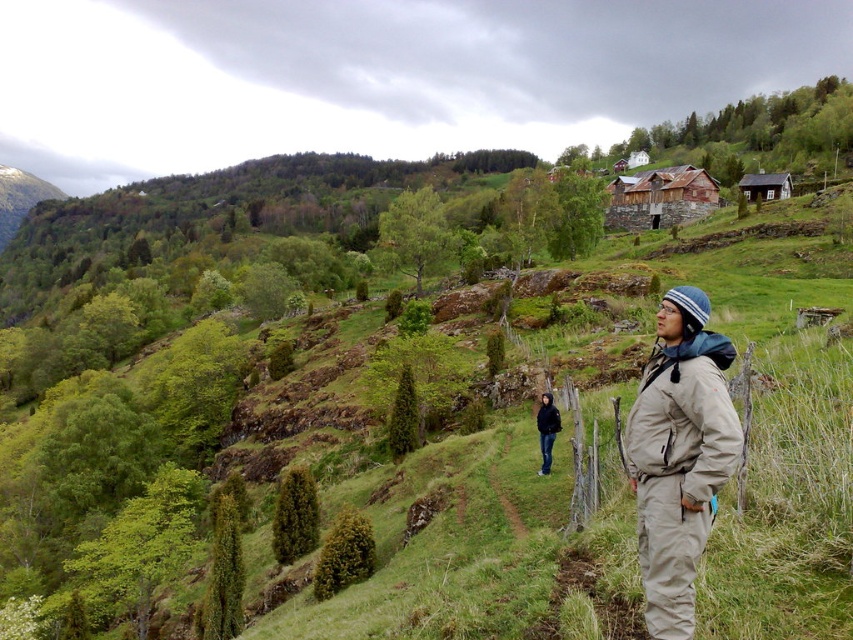
Describe the element at coordinates (172, 449) in the screenshot. I see `green grassy hillside at center` at that location.

Between green grassy hillside at center and dark blue jacket at center, which one is positioned higher?

dark blue jacket at center is higher up.

Between point (831, 445) and point (537, 428), which one is positioned in front?

Point (831, 445) is in front.

This screenshot has width=853, height=640. In order to click on green grassy hillside at center in this screenshot , I will do 172,449.

Does khaki fleece jacket at center have a greater height compared to dark blue jacket at center?

No, khaki fleece jacket at center is not taller than dark blue jacket at center.

The width and height of the screenshot is (853, 640). Find the location of `khaki fleece jacket at center`. khaki fleece jacket at center is located at coordinates (685, 417).

Measure the distance between green grassy hillside at center and khaki fleece jacket at center.

green grassy hillside at center is 155.07 feet away from khaki fleece jacket at center.

The width and height of the screenshot is (853, 640). What are the coordinates of `green grassy hillside at center` in the screenshot? It's located at (172, 449).

Which is in front, point (624, 529) or point (712, 440)?

Point (712, 440) is in front.

Identify the location of green grassy hillside at center. This screenshot has width=853, height=640. (172, 449).